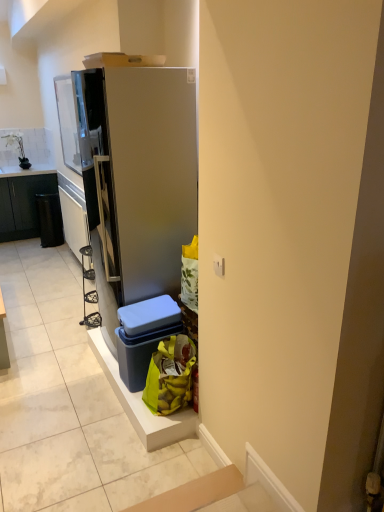
Question: From a real-world perspective, is yellow plastic bag at lower right on top of satin silver refrigerator at center?

Choices:
 (A) yes
 (B) no

Answer: (B)

Question: From the image's perspective, is yellow plastic bag at lower right beneath satin silver refrigerator at center?

Choices:
 (A) yes
 (B) no

Answer: (A)

Question: Does yellow plastic bag at lower right have a larger size compared to satin silver refrigerator at center?

Choices:
 (A) yes
 (B) no

Answer: (B)

Question: From the image's perspective, is yellow plastic bag at lower right on top of satin silver refrigerator at center?

Choices:
 (A) yes
 (B) no

Answer: (B)

Question: Is yellow plastic bag at lower right thinner than satin silver refrigerator at center?

Choices:
 (A) no
 (B) yes

Answer: (B)

Question: Is satin silver refrigerator at center wider or thinner than metallic silver shelf at left?

Choices:
 (A) thin
 (B) wide

Answer: (B)

Question: From the image's perspective, is satin silver refrigerator at center positioned above or below metallic silver shelf at left?

Choices:
 (A) below
 (B) above

Answer: (A)

Question: Considering the positions of satin silver refrigerator at center and metallic silver shelf at left in the image, is satin silver refrigerator at center taller or shorter than metallic silver shelf at left?

Choices:
 (A) tall
 (B) short

Answer: (A)

Question: From a real-world perspective, relative to metallic silver shelf at left, is satin silver refrigerator at center vertically above or below?

Choices:
 (A) above
 (B) below

Answer: (A)

Question: From the image's perspective, relative to blue plastic storage box at lower center, is metallic silver shelf at left above or below?

Choices:
 (A) above
 (B) below

Answer: (A)

Question: In the image, is metallic silver shelf at left on the left side or the right side of blue plastic storage box at lower center?

Choices:
 (A) left
 (B) right

Answer: (A)

Question: Which is correct: metallic silver shelf at left is inside blue plastic storage box at lower center, or outside of it?

Choices:
 (A) outside
 (B) inside

Answer: (A)

Question: Is metallic silver shelf at left in front of or behind blue plastic storage box at lower center in the image?

Choices:
 (A) behind
 (B) front

Answer: (A)

Question: From the image's perspective, is black matte trash can at left above or below satin silver refrigerator at center?

Choices:
 (A) above
 (B) below

Answer: (A)

Question: Is black matte trash can at left taller or shorter than satin silver refrigerator at center?

Choices:
 (A) short
 (B) tall

Answer: (A)